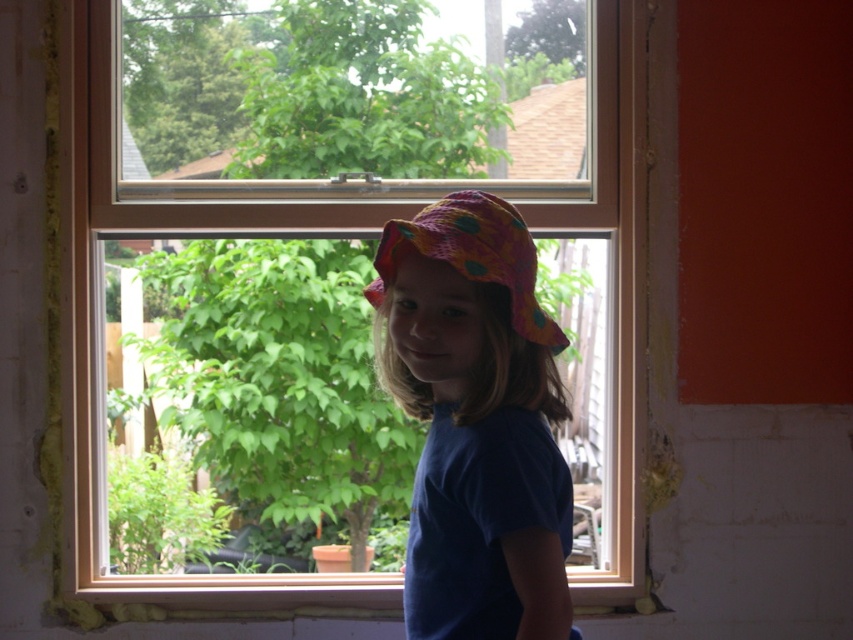
Question: Which point is farther to the camera?

Choices:
 (A) (71, 262)
 (B) (491, 506)
 (C) (525, 280)

Answer: (A)

Question: Does clear glass window at center appear under polka dot fabric hat at center?

Choices:
 (A) yes
 (B) no

Answer: (A)

Question: Is clear glass window at center closer to camera compared to matte pink fabric hat at center?

Choices:
 (A) yes
 (B) no

Answer: (B)

Question: Which of the following is the farthest from the observer?

Choices:
 (A) matte pink fabric hat at center
 (B) clear glass window at center
 (C) polka dot fabric hat at center

Answer: (B)

Question: Is clear glass window at center smaller than matte pink fabric hat at center?

Choices:
 (A) yes
 (B) no

Answer: (B)

Question: Which point is farther to the camera?

Choices:
 (A) clear glass window at center
 (B) polka dot fabric hat at center
 (C) matte pink fabric hat at center

Answer: (A)